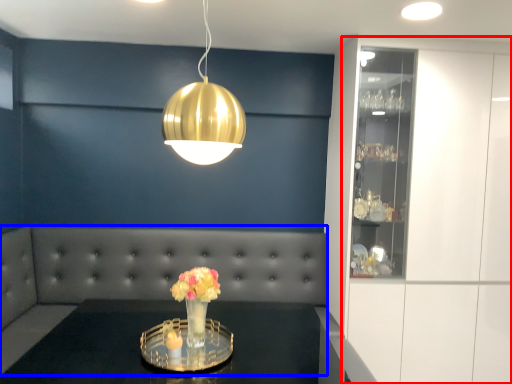
Question: Which of the following is the farthest to the observer, cabinetry (highlighted by a red box) or couch (highlighted by a blue box)?

Choices:
 (A) cabinetry
 (B) couch

Answer: (A)